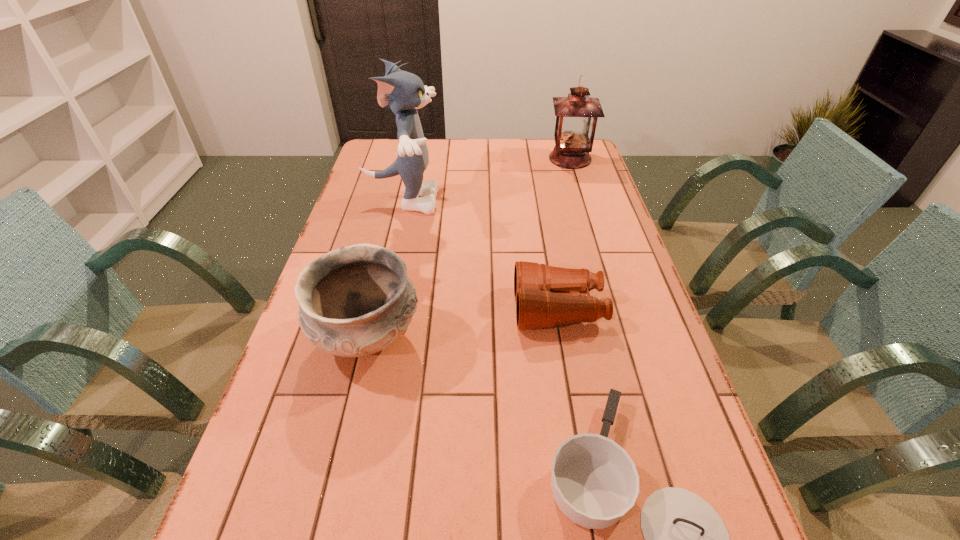
Locate an element on the screen. cat situated at the far edge is located at coordinates (403, 92).

Identify the location of oil lamp located in the far edge section of the desktop. Image resolution: width=960 pixels, height=540 pixels. (576, 115).

The width and height of the screenshot is (960, 540). I want to click on cat positioned at the left edge, so click(403, 92).

The image size is (960, 540). What are the coordinates of `pottery at the left edge` in the screenshot? It's located at [354, 301].

Identify the location of oil lamp that is at the right edge. Image resolution: width=960 pixels, height=540 pixels. (576, 115).

You are a GUI agent. You are given a task and a screenshot of the screen. Output one action in this format:
    pyautogui.click(x=<x>, y=<y>)
    Task: Click on the binoculars at the right edge
    The width and height of the screenshot is (960, 540).
    Given the screenshot: What is the action you would take?
    pyautogui.click(x=546, y=296)

The image size is (960, 540). Identify the location of object situated at the far left corner. (403, 92).

Find the location of `object located at the far right corner`. object located at the far right corner is located at coordinates (576, 115).

In the image, there is a desktop. Where is `free space at the far edge`? The width and height of the screenshot is (960, 540). free space at the far edge is located at coordinates (493, 157).

Identify the location of vacant area at the left edge. The width and height of the screenshot is (960, 540). (329, 468).